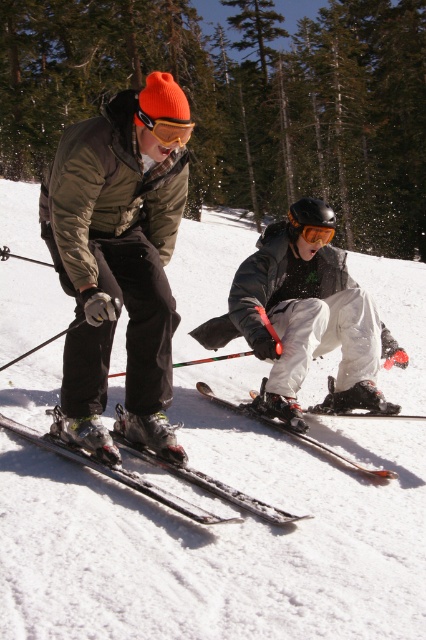
Can you confirm if matte black ski at left is smaller than orange matte/glossy goggles at center?

Incorrect, matte black ski at left is not smaller in size than orange matte/glossy goggles at center.

Between point (161, 172) and point (189, 131), which one is positioned in front?

Positioned in front is point (189, 131).

Which is in front, point (55, 205) or point (154, 131)?

Point (154, 131) is more forward.

The height and width of the screenshot is (640, 426). I want to click on matte black ski at left, so click(118, 262).

Is shiny black ski at center wider than glossy orange goggles at center?

Indeed, shiny black ski at center has a greater width compared to glossy orange goggles at center.

The height and width of the screenshot is (640, 426). I want to click on shiny black ski at center, so click(x=296, y=435).

Which is in front, point (271, 419) or point (311, 236)?

Point (311, 236)

You are a GUI agent. You are given a task and a screenshot of the screen. Output one action in this format:
    pyautogui.click(x=<x>, y=<y>)
    Task: Click on the shiny black ski at center
    Image resolution: width=426 pixels, height=640 pixels.
    Given the screenshot: What is the action you would take?
    pyautogui.click(x=296, y=435)

Between shiny metallic skis at center and shiny black ski at center, which one is positioned lower?

shiny metallic skis at center

This screenshot has height=640, width=426. I want to click on shiny metallic skis at center, so click(x=108, y=468).

This screenshot has width=426, height=640. Identify the location of shiny metallic skis at center. pyautogui.click(x=108, y=468).